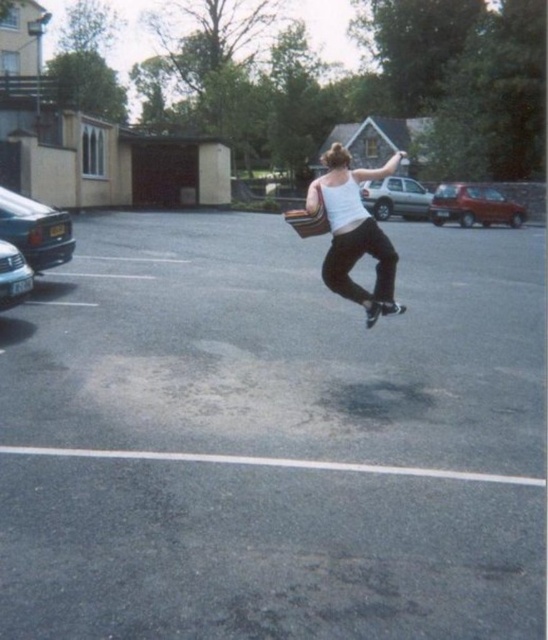
You are a delivery drone with a wingspan of 1.8 meters. You need to fly from the silver metallic car at left to the asphalt at center. Is there enough space for you to pass through the area between them without touching either?

The asphalt at center is 2.25 meters away from the silver metallic car at left. Since your wingspan is 1.8 meters, there is sufficient space to pass through as the distance between them is greater than your wingspan.

You are a photographer standing in the parking lot. You see the white matte tank top at center and the silver metallic car at left. Which object is higher in the image?

The white matte tank top at center is higher than the silver metallic car at left.

You are trying to park your car in the parking lot. You see the asphalt at center and the silver metallic car at left. Which area has more space for your car to fit?

The asphalt at center might be wider than the silver metallic car at left, so the asphalt at center likely has more space for your car to fit.